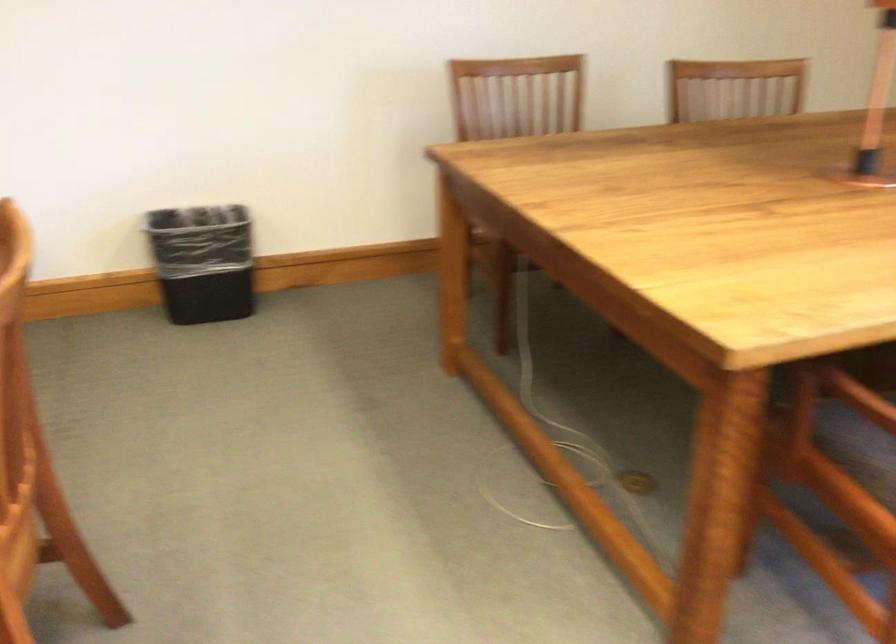
You are a GUI agent. You are given a task and a screenshot of the screen. Output one action in this format:
    pyautogui.click(x=<x>, y=<y>)
    Task: Click on the chair sitting surface
    This screenshot has height=644, width=896.
    Given the screenshot: What is the action you would take?
    pyautogui.click(x=885, y=442)